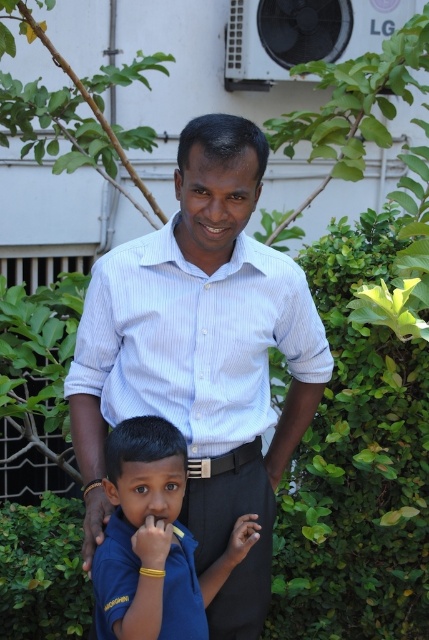
Which is more to the right, white striped shirt at center or light blue striped shirt at center?

Positioned to the right is white striped shirt at center.

Is white striped shirt at center above light blue striped shirt at center?

No.

Between point (280, 472) and point (248, 305), which one is positioned in front?

Point (248, 305) is more forward.

This screenshot has width=429, height=640. Find the location of `white striped shirt at center`. white striped shirt at center is located at coordinates (205, 355).

Is point (144, 522) positioned after point (238, 531)?

No, it is not.

Between point (154, 552) and point (247, 532), which one is positioned in front?

Point (154, 552) is in front.

Locate an element on the screen. yellow matte bracelet at lower center is located at coordinates (153, 541).

Can you confirm if white striped shirt at center is shorter than smooth skin hand at lower center?

In fact, white striped shirt at center may be taller than smooth skin hand at lower center.

Does white striped shirt at center appear on the left side of smooth skin hand at lower center?

Indeed, white striped shirt at center is positioned on the left side of smooth skin hand at lower center.

Which is in front, point (99, 433) or point (250, 531)?

Point (250, 531) is more forward.

Locate an element on the screen. white striped shirt at center is located at coordinates (205, 355).